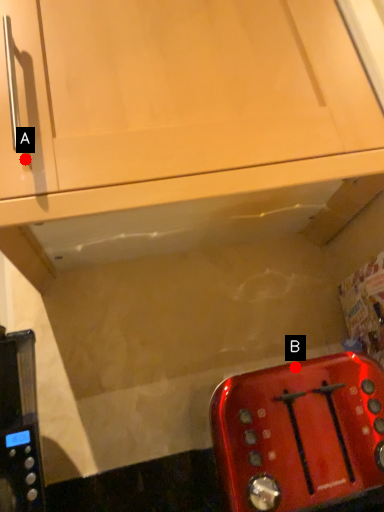
Question: Two points are circled on the image, labeled by A and B beside each circle. Which point appears farthest from the camera in this image?

Choices:
 (A) A is further
 (B) B is further

Answer: (B)